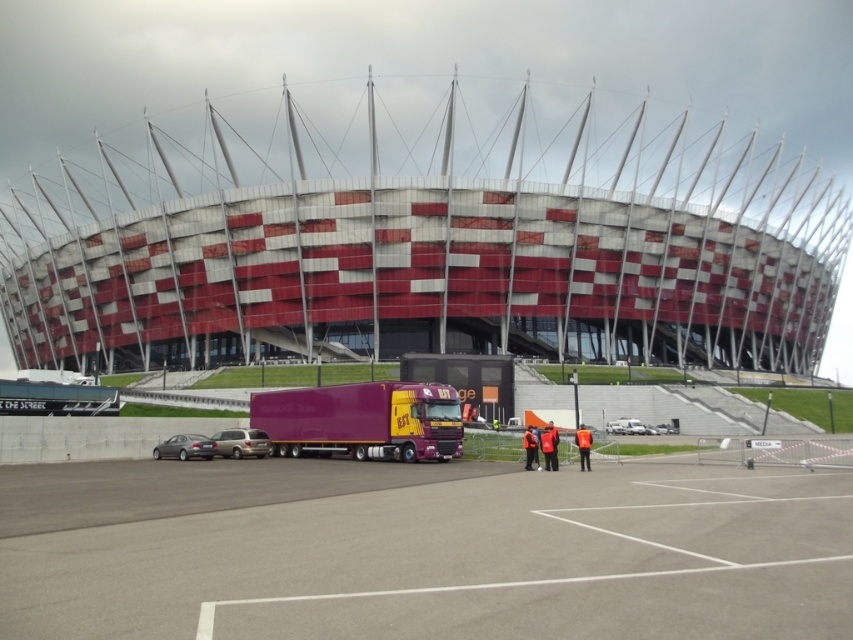
You are standing at the center of the paved area in front of the stadium. You want to move directly towards the purple glossy trailer truck at center. Which direction should you walk? Please answer with either north, south, east, or west.

Since the purple glossy trailer truck at center is located at coordinates 0.658 on the x and 0.426 on the y axis, you should walk east to reach it.

You are standing at the point marked by the coordinates point (241,442). Looking towards the stadium, which object is directly in front of you?

The silver metallic car at center is directly in front of you at point (241,442).

You are a photographer planning to capture the entire view of the stadium and its parked vehicles. You notice the silver metallic car at center and the silver metallic sedan at lower left. Which vehicle should you avoid moving to ensure your photo includes both vehicles without any obstruction?

You should avoid moving the silver metallic sedan at lower left because it occupies more space than the silver metallic car at center, so moving the larger sedan might block the view of the smaller car.